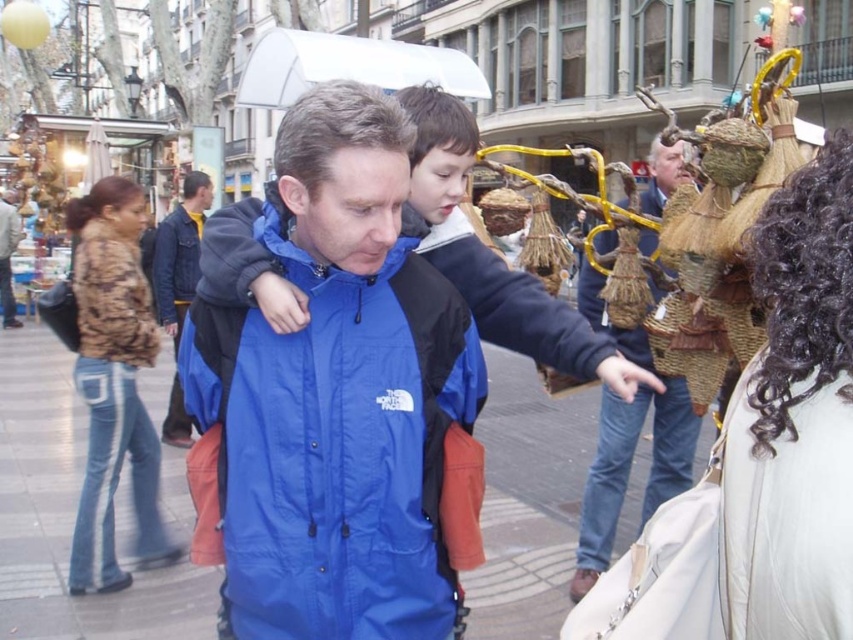
Question: Is blue nylon jacket at center closer to the viewer compared to blue nylon jacket at upper left?

Choices:
 (A) no
 (B) yes

Answer: (B)

Question: Is camo fabric jacket at left bigger than blue nylon jacket at upper left?

Choices:
 (A) no
 (B) yes

Answer: (B)

Question: Which object is farther from the camera taking this photo?

Choices:
 (A) denim jacket at left
 (B) blue fabric jacket at center

Answer: (A)

Question: Which point is farther from the camera taking this photo?

Choices:
 (A) (180, 410)
 (B) (154, 563)
 (C) (485, 381)
 (D) (601, 410)

Answer: (A)

Question: Does curly hair at upper right have a greater width compared to denim jacket at left?

Choices:
 (A) no
 (B) yes

Answer: (A)

Question: Among these points, which one is nearest to the camera?

Choices:
 (A) (x=173, y=237)
 (B) (x=375, y=630)

Answer: (B)